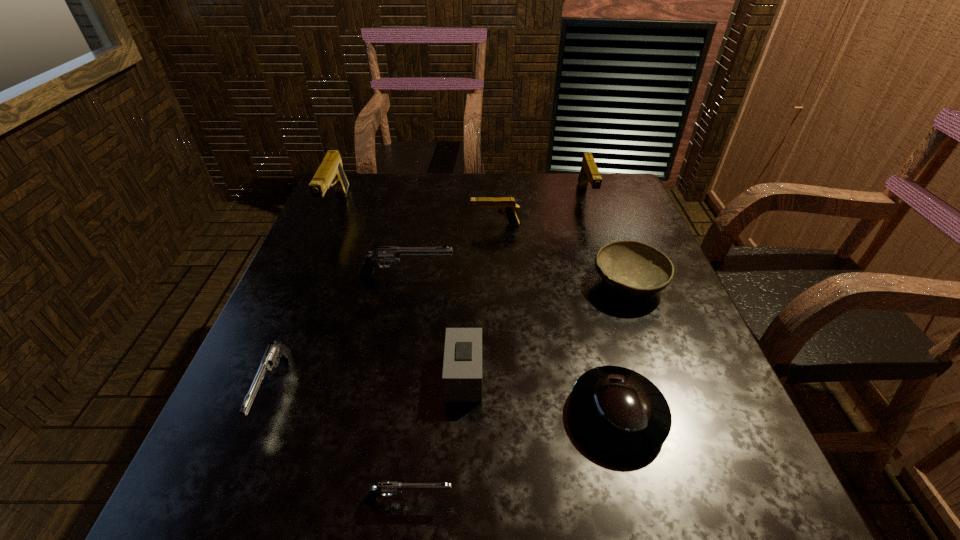
Locate an element on the screen. This screenshot has width=960, height=540. free point between the shortest pistol and the tallest object is located at coordinates (372, 354).

Where is `free space between the leftmost object and the gray saucer`? This screenshot has width=960, height=540. free space between the leftmost object and the gray saucer is located at coordinates (477, 311).

The image size is (960, 540). I want to click on vacant region between the second farthest silver pistol and the alarm clock, so click(x=369, y=382).

Find the location of `vacant space in between the biggest silver pistol and the second pistol from left to right`. vacant space in between the biggest silver pistol and the second pistol from left to right is located at coordinates (340, 333).

Where is `unoccupied area between the alarm clock and the fifth pistol from left to right`? unoccupied area between the alarm clock and the fifth pistol from left to right is located at coordinates pyautogui.click(x=479, y=300).

Identify the location of empty space between the third nearest pistol and the gray saucer. This screenshot has width=960, height=540. (512, 346).

Identify which object is located as the second nearest to the nearest silver pistol. Please provide its 2D coordinates. Your answer should be formatted as a tuple, i.e. [(x, y)], where the tuple contains the x and y coordinates of a point satisfying the conditions above.

[(622, 411)]

Choose which object is the sixth nearest neighbor to the second smallest tan pistol. Please provide its 2D coordinates. Your answer should be formatted as a tuple, i.e. [(x, y)], where the tuple contains the x and y coordinates of a point satisfying the conditions above.

[(330, 173)]

I want to click on pistol that stands as the closest to the farthest silver pistol, so click(x=507, y=205).

At what (x,y) coordinates should I click in order to perform the action: click on pistol that is the second closest to the gray bowl. Please return your answer as a coordinate pair (x, y). The width and height of the screenshot is (960, 540). Looking at the image, I should click on click(507, 205).